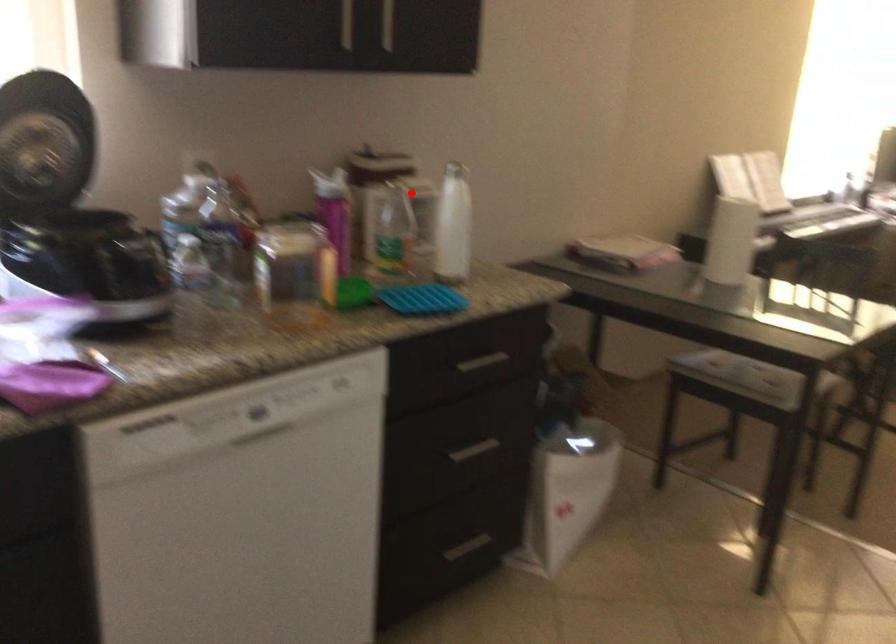
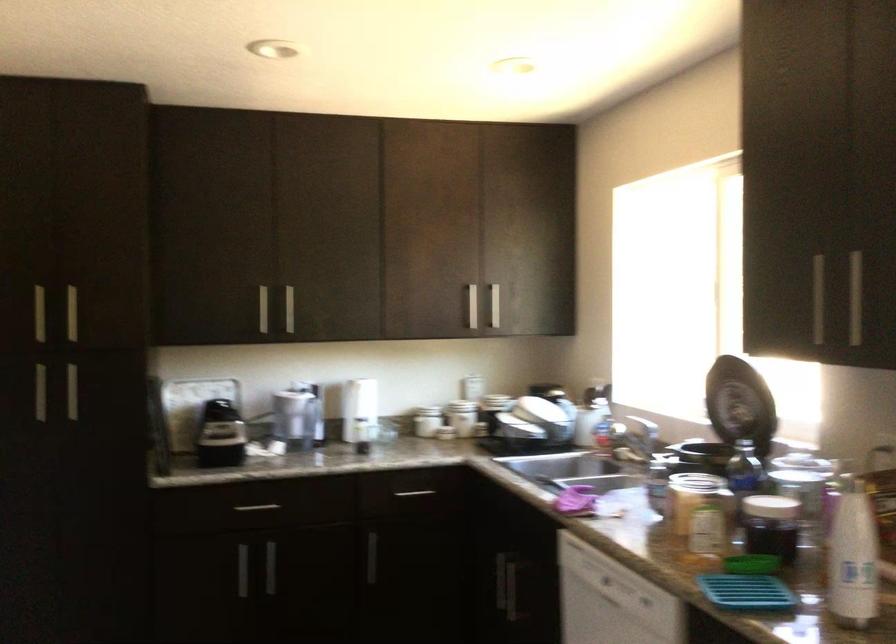
Locate, in the second image, the point that corresponds to the highlighted location in the first image.

(853, 556)